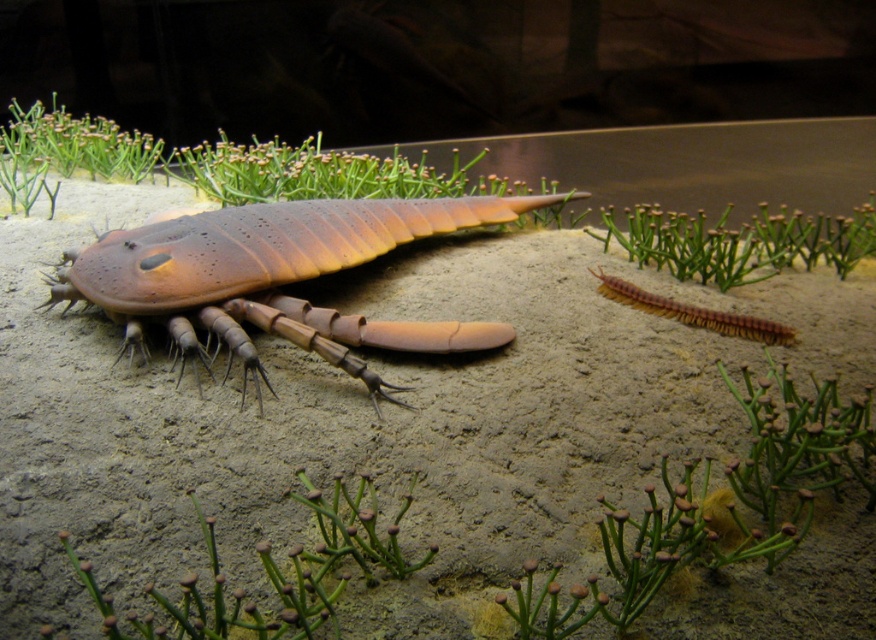
Question: Which object is closer to the camera taking this photo?

Choices:
 (A) matte brown crustacean at center
 (B) brown fuzzy centipede at lower right

Answer: (A)

Question: Is matte brown crustacean at center wider than brown fuzzy centipede at lower right?

Choices:
 (A) no
 (B) yes

Answer: (B)

Question: Is the position of matte brown crustacean at center less distant than that of brown fuzzy centipede at lower right?

Choices:
 (A) yes
 (B) no

Answer: (A)

Question: Which point is farther to the camera?

Choices:
 (A) (83, 272)
 (B) (740, 321)

Answer: (B)

Question: Does matte brown crustacean at center appear on the left side of brown fuzzy centipede at lower right?

Choices:
 (A) yes
 (B) no

Answer: (A)